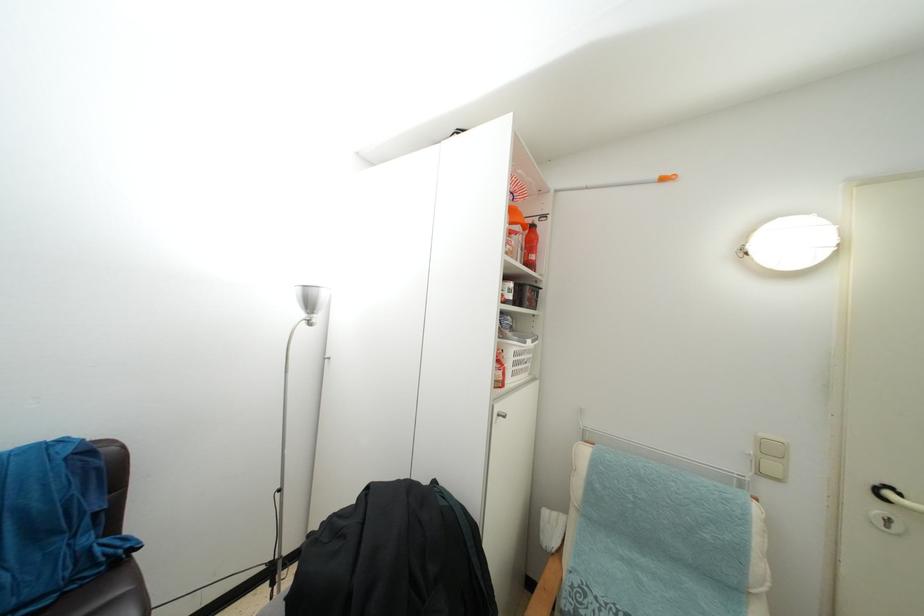
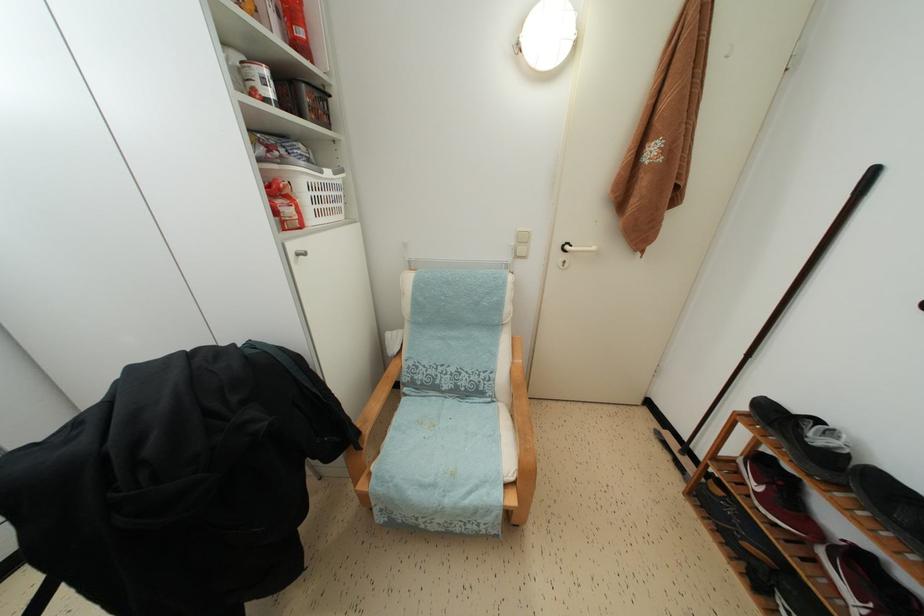
Locate, in the second image, the point that corresponds to (x=537, y=262) in the first image.

(305, 38)